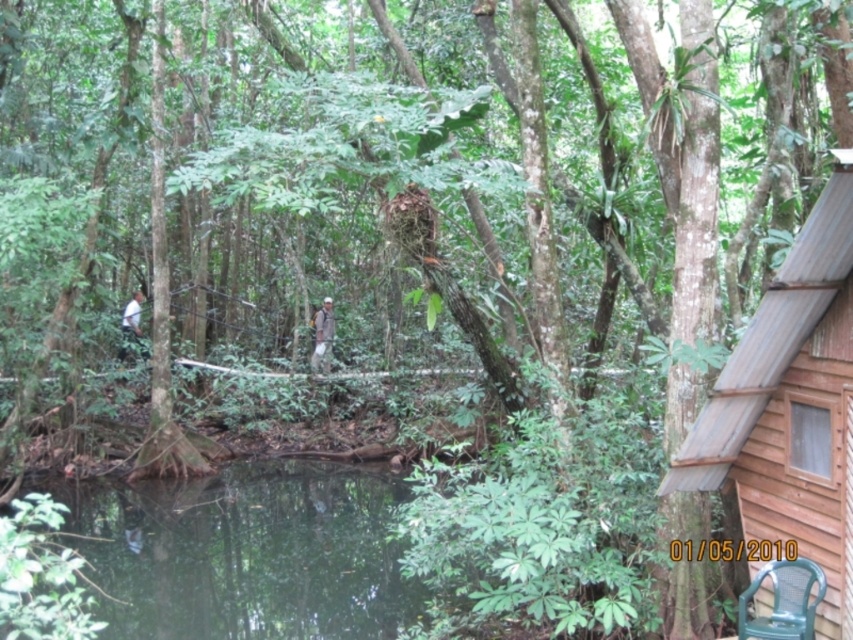
Question: Which object is closer to the camera taking this photo?

Choices:
 (A) brown fabric backpack at center
 (B) white matte shirt at left

Answer: (B)

Question: Does brown fabric backpack at center lie behind white matte shirt at left?

Choices:
 (A) no
 (B) yes

Answer: (B)

Question: Can you confirm if brown fabric backpack at center is positioned to the left of white matte shirt at left?

Choices:
 (A) no
 (B) yes

Answer: (A)

Question: Considering the real-world distances, which object is farthest from the white matte shirt at left?

Choices:
 (A) brown wooden cabin at right
 (B) brown fabric backpack at center

Answer: (A)

Question: Which point is closer to the camera?

Choices:
 (A) brown fabric backpack at center
 (B) white matte shirt at left

Answer: (B)

Question: Can you confirm if brown wooden cabin at right is positioned to the left of brown fabric backpack at center?

Choices:
 (A) yes
 (B) no

Answer: (B)